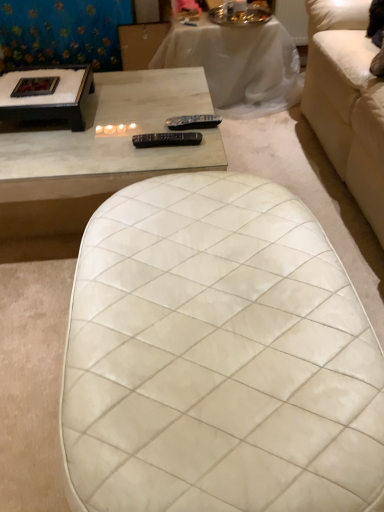
I want to click on black plastic remote at center, the 2th remote in the front-to-back sequence, so click(x=193, y=122).

Identify the location of white marble table at upper center, the 1th table viewed from the top. Image resolution: width=384 pixels, height=512 pixels. (238, 65).

Locate an element on the screen. Image resolution: width=384 pixels, height=512 pixels. black wood coffee table at upper left, which ranks as the second coffee table in right-to-left order is located at coordinates (46, 94).

Describe the element at coordinates (63, 32) in the screenshot. I see `blue floral fabric at upper left` at that location.

Identify the location of black plastic remote at center, the 2th remote in the back-to-front sequence. Image resolution: width=384 pixels, height=512 pixels. (167, 139).

From a real-world perspective, who is located lower, blue floral fabric at upper left or black plastic remote at center, which ranks as the first remote in top-to-bottom order?

In real-world perspective, blue floral fabric at upper left is lower.

Would you consider blue floral fabric at upper left to be distant from black plastic remote at center, which ranks as the first remote in top-to-bottom order?

Yes, blue floral fabric at upper left and black plastic remote at center, which ranks as the first remote in top-to-bottom order, are quite far apart.

Is blue floral fabric at upper left aimed at black plastic remote at center, which appears as the 2th remote when ordered from the bottom?

Yes, blue floral fabric at upper left is aimed at black plastic remote at center, which appears as the 2th remote when ordered from the bottom.

Who is shorter, blue floral fabric at upper left or black plastic remote at center, which appears as the 1th remote when viewed from the back?

Standing shorter between the two is black plastic remote at center, which appears as the 1th remote when viewed from the back.

Looking at this image, is black plastic remote at center, which appears as the 1th remote when viewed from the back, turned away from black wood coffee table at upper left, which ranks as the first coffee table in left-to-right order?

black plastic remote at center, which appears as the 1th remote when viewed from the back, is not turned away from black wood coffee table at upper left, which ranks as the first coffee table in left-to-right order.

Between black plastic remote at center, which ranks as the first remote in top-to-bottom order, and black wood coffee table at upper left, which ranks as the second coffee table in right-to-left order, which one has less height?

Standing shorter between the two is black plastic remote at center, which ranks as the first remote in top-to-bottom order.

How different are the orientations of black plastic remote at center, which ranks as the first remote in top-to-bottom order, and black wood coffee table at upper left, which ranks as the first coffee table in left-to-right order, in degrees?

The angle between the facing direction of black plastic remote at center, which ranks as the first remote in top-to-bottom order, and the facing direction of black wood coffee table at upper left, which ranks as the first coffee table in left-to-right order, is 2.93 degrees.

Based on the photo, from the image's perspective, is black plastic remote at center, which appears as the 2th remote when ordered from the bottom, above black wood coffee table at upper left, which ranks as the first coffee table in left-to-right order?

No, from the image's perspective, black plastic remote at center, which appears as the 2th remote when ordered from the bottom, is not over black wood coffee table at upper left, which ranks as the first coffee table in left-to-right order.

Considering the positions of objects black plastic remote at center, the 2th remote in the front-to-back sequence, and white quilted ottoman at center, acting as the 2th table starting from the top, in the image provided, who is more to the left, black plastic remote at center, the 2th remote in the front-to-back sequence, or white quilted ottoman at center, acting as the 2th table starting from the top,?

From the viewer's perspective, black plastic remote at center, the 2th remote in the front-to-back sequence, appears more on the left side.

Considering the sizes of black plastic remote at center, the 2th remote in the front-to-back sequence, and white quilted ottoman at center, acting as the 2th table starting from the top, in the image, is black plastic remote at center, the 2th remote in the front-to-back sequence, bigger or smaller than white quilted ottoman at center, acting as the 2th table starting from the top,?

Clearly, black plastic remote at center, the 2th remote in the front-to-back sequence, is smaller in size than white quilted ottoman at center, acting as the 2th table starting from the top.

Which point is more forward, (173, 120) or (333, 426)?

The point (333, 426) is more forward.

Between point (56, 104) and point (17, 59), which one is positioned behind?

The point (17, 59) is more distant.

Between black wood coffee table at upper left, which ranks as the second coffee table in right-to-left order, and blue floral fabric at upper left, which one appears on the right side from the viewer's perspective?

Positioned to the right is black wood coffee table at upper left, which ranks as the second coffee table in right-to-left order.

Which coffee table is the 1st one when counting from the front of the blue floral fabric at upper left? Please provide its 2D coordinates.

[(46, 94)]

From a real-world perspective, is black wood coffee table at upper left, which ranks as the first coffee table in left-to-right order, located higher than blue floral fabric at upper left?

Yes, from a real-world perspective, black wood coffee table at upper left, which ranks as the first coffee table in left-to-right order, is above blue floral fabric at upper left.

How far apart are white quilted ottoman at center, the first table ordered from the bottom, and black wood coffee table at upper left, which ranks as the second coffee table in right-to-left order?

white quilted ottoman at center, the first table ordered from the bottom, is 33.59 inches from black wood coffee table at upper left, which ranks as the second coffee table in right-to-left order.

Between white quilted ottoman at center, acting as the 2th table starting from the top, and black wood coffee table at upper left, which ranks as the first coffee table in left-to-right order, which one appears on the left side from the viewer's perspective?

From the viewer's perspective, black wood coffee table at upper left, which ranks as the first coffee table in left-to-right order, appears more on the left side.

Can you tell me how much white quilted ottoman at center, acting as the 2th table starting from the top, and black wood coffee table at upper left, which ranks as the second coffee table in right-to-left order, differ in facing direction?

The angular difference between white quilted ottoman at center, acting as the 2th table starting from the top, and black wood coffee table at upper left, which ranks as the second coffee table in right-to-left order, is 87.5 degrees.

Could you tell me if white quilted ottoman at center, the first table ordered from the bottom, is facing black wood coffee table at upper left, which ranks as the second coffee table in right-to-left order?

No, white quilted ottoman at center, the first table ordered from the bottom, is not turned towards black wood coffee table at upper left, which ranks as the second coffee table in right-to-left order.

From the image's perspective, is white marble table at upper center, which appears as the second table when ordered from the bottom, below black wood coffee table at upper left, which ranks as the first coffee table in left-to-right order?

No.

From a real-world perspective, is white marble table at upper center, which is counted as the first table, starting from the back, on top of black wood coffee table at upper left, which ranks as the first coffee table in left-to-right order?

No, from a real-world perspective, white marble table at upper center, which is counted as the first table, starting from the back, is not over black wood coffee table at upper left, which ranks as the first coffee table in left-to-right order

Considering the sizes of white marble table at upper center, the 1th table viewed from the top, and black wood coffee table at upper left, which ranks as the first coffee table in left-to-right order, in the image, is white marble table at upper center, the 1th table viewed from the top, bigger or smaller than black wood coffee table at upper left, which ranks as the first coffee table in left-to-right order,?

Clearly, white marble table at upper center, the 1th table viewed from the top, is larger in size than black wood coffee table at upper left, which ranks as the first coffee table in left-to-right order.

Is point (267, 44) closer to camera compared to point (34, 83)?

That is False.

Considering the positions of objects white quilted ottoman at center, acting as the 2th table starting from the top, and blue floral fabric at upper left in the image provided, who is more to the right, white quilted ottoman at center, acting as the 2th table starting from the top, or blue floral fabric at upper left?

Positioned to the right is white quilted ottoman at center, acting as the 2th table starting from the top.

Is white quilted ottoman at center, acting as the 2th table starting from the top, not within blue floral fabric at upper left?

white quilted ottoman at center, acting as the 2th table starting from the top, lies outside blue floral fabric at upper left's area.

From the image's perspective, which table is the 2nd one below the blue floral fabric at upper left? Please provide its 2D coordinates.

[(217, 357)]

Which object is thinner, white quilted ottoman at center, marked as the 1th table in a front-to-back arrangement, or blue floral fabric at upper left?

blue floral fabric at upper left.

In order to click on the 1st remote directly above the blue floral fabric at upper left (from a real-world perspective) in this screenshot , I will do `click(193, 122)`.

Starting from the black plastic remote at center, which ranks as the first remote in top-to-bottom order, which coffee table is the 1st one in front? Please provide its 2D coordinates.

[(46, 94)]

From the image, which object appears to be farther from white quilted ottoman at center, acting as the 2th table starting from the top, blue floral fabric at upper left or white marble table at upper center, which is counted as the first table, starting from the back?

blue floral fabric at upper left lies further to white quilted ottoman at center, acting as the 2th table starting from the top, than the other object.

Which object lies nearer to the anchor point black plastic remote at center, which appears as the 2th remote when ordered from the bottom, black plastic remote at center, the 2th remote in the back-to-front sequence, or white marble table at upper center, which appears as the second table when ordered from the bottom?

The object closer to black plastic remote at center, which appears as the 2th remote when ordered from the bottom, is black plastic remote at center, the 2th remote in the back-to-front sequence.

Based on their spatial positions, is blue floral fabric at upper left or black plastic remote at center, which ranks as the first remote in top-to-bottom order, closer to black plastic remote at center, the 2th remote in the back-to-front sequence?

black plastic remote at center, which ranks as the first remote in top-to-bottom order, is positioned closer to the anchor black plastic remote at center, the 2th remote in the back-to-front sequence.

Estimate the real-world distances between objects in this image. Which object is further from white marble coffee table at upper left, acting as the first coffee table starting from the right, black plastic remote at center, the 2th remote viewed from the top, or black wood coffee table at upper left, which ranks as the second coffee table in right-to-left order?

Among the two, black plastic remote at center, the 2th remote viewed from the top, is located further to white marble coffee table at upper left, acting as the first coffee table starting from the right.

Which object lies nearer to the anchor point white marble coffee table at upper left, acting as the first coffee table starting from the right, blue floral fabric at upper left or black plastic remote at center, the 2th remote in the back-to-front sequence?

black plastic remote at center, the 2th remote in the back-to-front sequence, lies closer to white marble coffee table at upper left, acting as the first coffee table starting from the right, than the other object.

Based on their spatial positions, is white marble table at upper center, which is counted as the first table, starting from the back, or white marble coffee table at upper left, placed as the 2th coffee table when sorted from left to right, closer to black plastic remote at center, the 2th remote in the front-to-back sequence?

Based on the image, white marble coffee table at upper left, placed as the 2th coffee table when sorted from left to right, appears to be nearer to black plastic remote at center, the 2th remote in the front-to-back sequence.

Looking at the image, which one is located further to white marble coffee table at upper left, acting as the first coffee table starting from the right, white marble table at upper center, which appears as the second table when ordered from the bottom, or white quilted ottoman at center, the first table ordered from the bottom?

white marble table at upper center, which appears as the second table when ordered from the bottom, is positioned further to the anchor white marble coffee table at upper left, acting as the first coffee table starting from the right.

Which object lies nearer to the anchor point black wood coffee table at upper left, which ranks as the second coffee table in right-to-left order, white marble coffee table at upper left, placed as the 2th coffee table when sorted from left to right, or white quilted ottoman at center, which appears as the 2th table when viewed from the back?

white marble coffee table at upper left, placed as the 2th coffee table when sorted from left to right.

Where is `table between white quilted ottoman at center, the first table ordered from the bottom, and blue floral fabric at upper left from front to back`? table between white quilted ottoman at center, the first table ordered from the bottom, and blue floral fabric at upper left from front to back is located at coordinates (238, 65).

Locate an element on the screen. This screenshot has width=384, height=512. coffee table between black plastic remote at center, the 2th remote viewed from the top, and blue floral fabric at upper left in the front-back direction is located at coordinates (46, 94).

Locate an element on the screen. The image size is (384, 512). remote between blue floral fabric at upper left and black plastic remote at center, placed as the 1th remote when sorted from front to back, vertically is located at coordinates (193, 122).

This screenshot has width=384, height=512. What are the coordinates of `coffee table between white marble coffee table at upper left, placed as the 2th coffee table when sorted from left to right, and blue floral fabric at upper left, along the z-axis` in the screenshot? It's located at (46, 94).